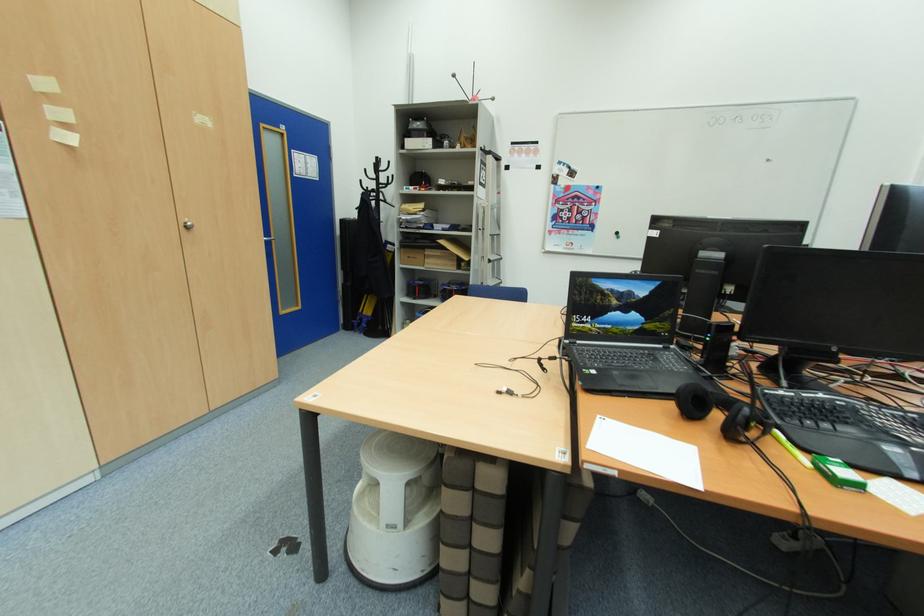
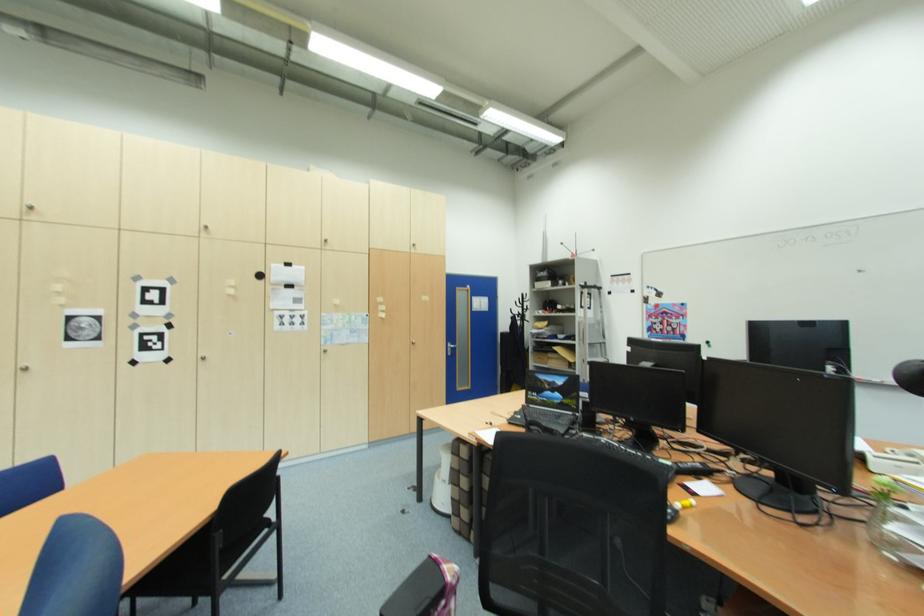
In the second image, find the point that corresponds to pixel 190 229 in the first image.

(418, 345)